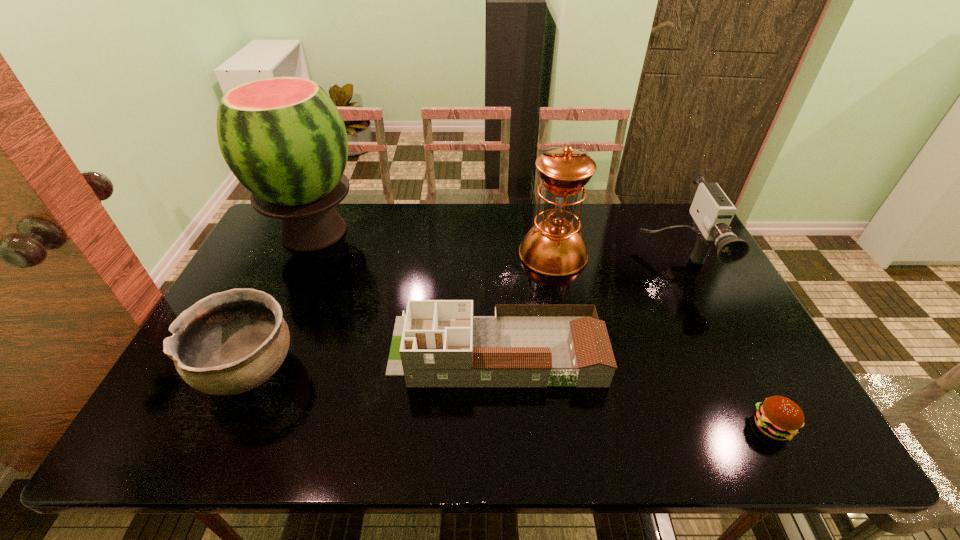
The height and width of the screenshot is (540, 960). Identify the location of the fifth closest object to the third tallest object. (231, 342).

The width and height of the screenshot is (960, 540). I want to click on the fifth closest object relative to the shortest object, so click(x=283, y=138).

In order to click on vacant point that satisfies the following two spatial constraints: 1. on the back side of the pottery; 2. on the left side of the oil lamp in this screenshot , I will do `click(302, 253)`.

I want to click on free spot that satisfies the following two spatial constraints: 1. at the main entrance of the hamburger; 2. on the right side of the dollhouse, so click(x=498, y=426).

Where is `blank area in the image that satisfies the following two spatial constraints: 1. on the front side of the oil lamp; 2. at the main entrance of the dollhouse`? Image resolution: width=960 pixels, height=540 pixels. blank area in the image that satisfies the following two spatial constraints: 1. on the front side of the oil lamp; 2. at the main entrance of the dollhouse is located at coordinates [x=571, y=350].